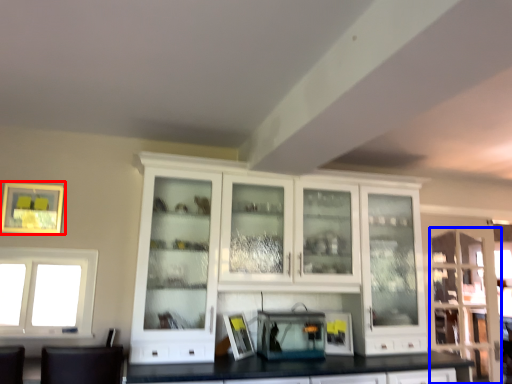
Question: Among these objects, which one is farthest to the camera, picture frame (highlighted by a red box) or glass door (highlighted by a blue box)?

Choices:
 (A) picture frame
 (B) glass door

Answer: (B)